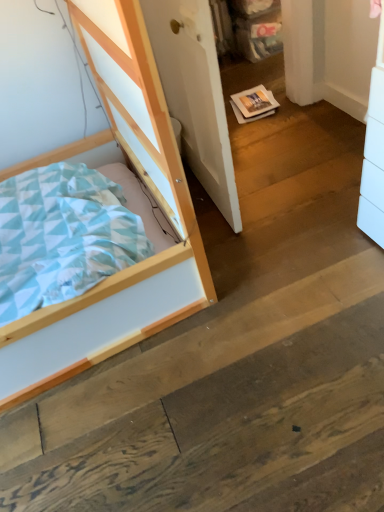
Question: Relative to light wood bed at left, is white matte door at center in front or behind?

Choices:
 (A) front
 (B) behind

Answer: (B)

Question: From a real-world perspective, relative to light wood bed at left, is white matte door at center vertically above or below?

Choices:
 (A) below
 (B) above

Answer: (A)

Question: Which is correct: white matte door at center is inside light wood bed at left, or outside of it?

Choices:
 (A) inside
 (B) outside

Answer: (B)

Question: In terms of height, does light wood bed at left look taller or shorter compared to white matte door at center?

Choices:
 (A) tall
 (B) short

Answer: (A)

Question: Based on their sizes in the image, would you say light wood bed at left is bigger or smaller than white matte door at center?

Choices:
 (A) big
 (B) small

Answer: (A)

Question: Does point (109, 296) appear closer or farther from the camera than point (215, 81)?

Choices:
 (A) closer
 (B) farther

Answer: (A)

Question: Is light wood bed at left inside the boundaries of white matte door at center, or outside?

Choices:
 (A) inside
 (B) outside

Answer: (B)